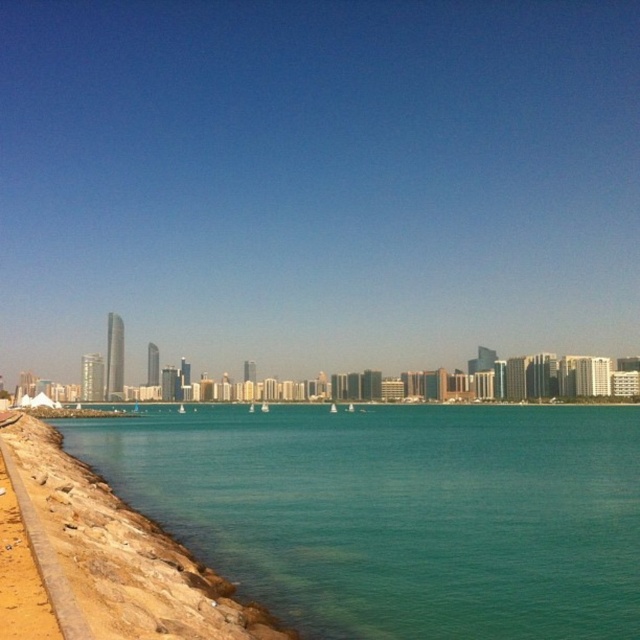
Question: Can you confirm if teal smooth water at lower left is positioned below brown rocky shoreline at lower left?

Choices:
 (A) no
 (B) yes

Answer: (B)

Question: Observing the image, what is the correct spatial positioning of teal smooth water at lower left in reference to brown rocky shoreline at lower left?

Choices:
 (A) above
 (B) below

Answer: (B)

Question: Which point is farther from the camera taking this photo?

Choices:
 (A) (88, 589)
 (B) (285, 426)

Answer: (B)

Question: Which object appears farthest from the camera in this image?

Choices:
 (A) brown rocky shoreline at lower left
 (B) teal smooth water at lower left

Answer: (B)

Question: Does teal smooth water at lower left have a greater width compared to brown rocky shoreline at lower left?

Choices:
 (A) no
 (B) yes

Answer: (B)